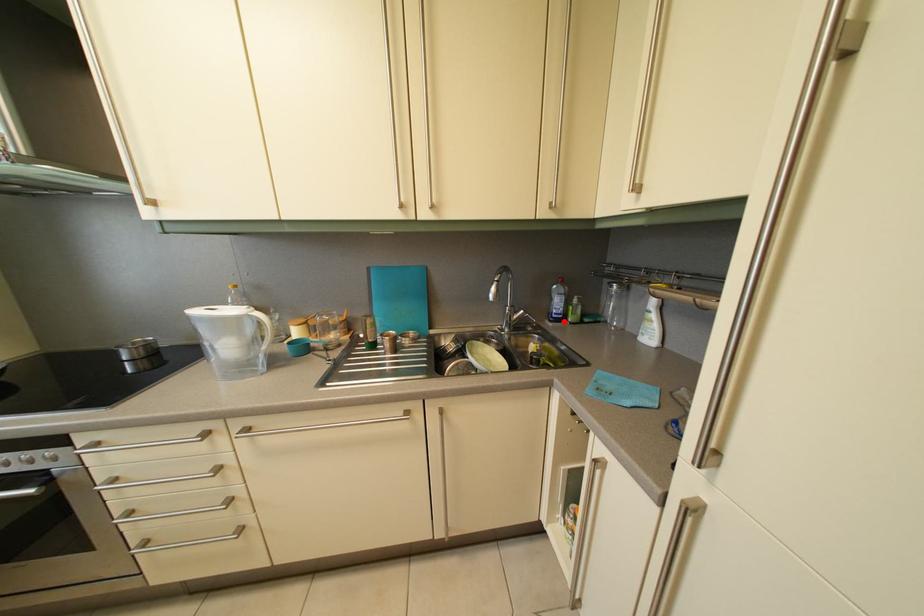
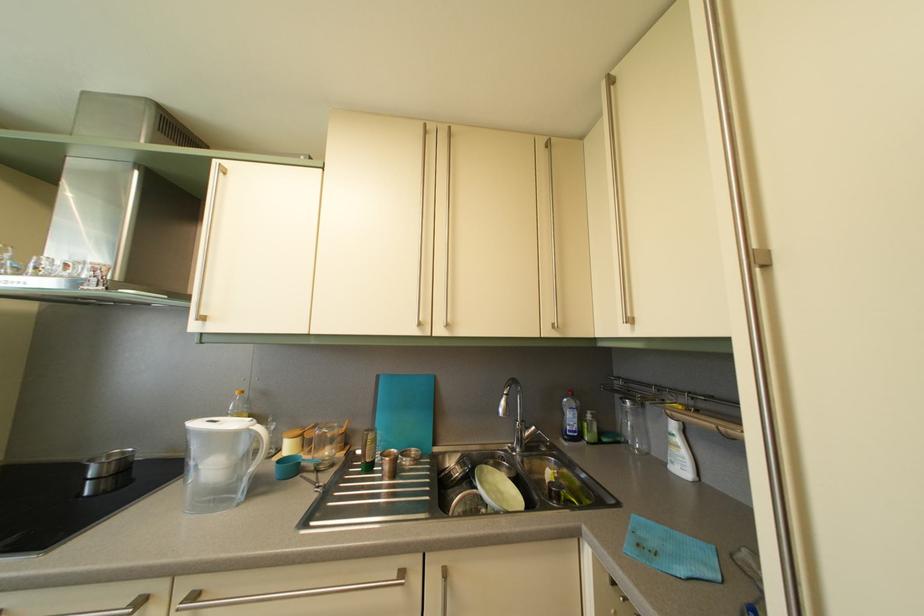
Question: A red point is marked in image1. In image2, is the corresponding 3D point closer to the camera or farther? Reply with the corresponding letter.

Choices:
 (A) The corresponding 3D point is closer.
 (B) The corresponding 3D point is farther.

Answer: (B)